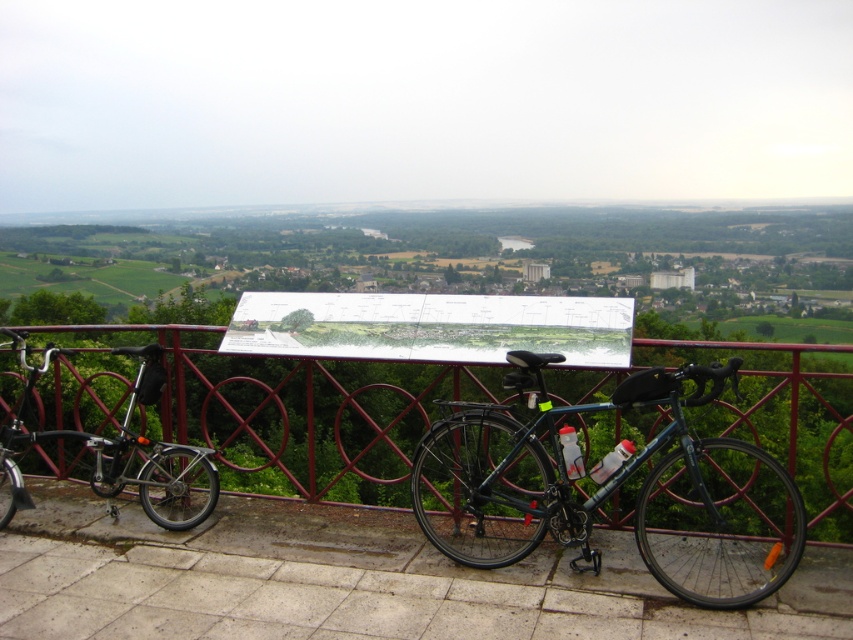
Does metallic red fence at center have a greater height compared to shiny black bicycle at left?

Yes, metallic red fence at center is taller than shiny black bicycle at left.

Can you confirm if metallic red fence at center is shorter than shiny black bicycle at left?

No, metallic red fence at center is not shorter than shiny black bicycle at left.

Does point (6, 374) lie in front of point (151, 376)?

No, it is not.

Locate an element on the screen. metallic red fence at center is located at coordinates (265, 408).

Can you confirm if metallic red fence at center is positioned to the right of shiny dark blue bike at center?

No, metallic red fence at center is not to the right of shiny dark blue bike at center.

Between metallic red fence at center and shiny dark blue bike at center, which one is positioned lower?

metallic red fence at center

The image size is (853, 640). What are the coordinates of `metallic red fence at center` in the screenshot? It's located at (265, 408).

Image resolution: width=853 pixels, height=640 pixels. Find the location of `metallic red fence at center`. metallic red fence at center is located at coordinates (265, 408).

Does point (788, 557) come in front of point (151, 509)?

Yes, point (788, 557) is closer to viewer.

Does shiny dark blue bike at center appear on the right side of shiny black bicycle at left?

Yes, shiny dark blue bike at center is to the right of shiny black bicycle at left.

Locate an element on the screen. This screenshot has height=640, width=853. shiny dark blue bike at center is located at coordinates (612, 492).

Find the location of a particular element. This screenshot has height=640, width=853. shiny dark blue bike at center is located at coordinates (612, 492).